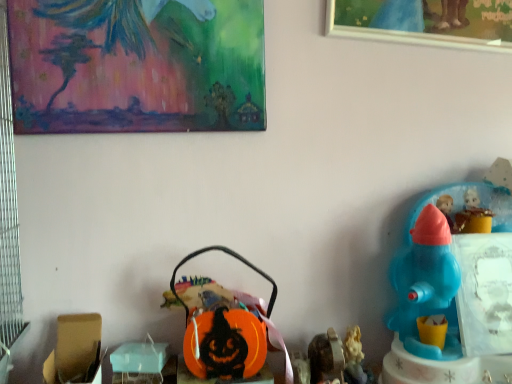
Image resolution: width=512 pixels, height=384 pixels. Describe the element at coordinates (354, 357) in the screenshot. I see `matte plastic figurine at lower right, the 2th toy from the right` at that location.

What do you see at coordinates (75, 350) in the screenshot? I see `matte cardboard box at lower left, the first toy positioned from the left` at bounding box center [75, 350].

This screenshot has width=512, height=384. Find the location of `wooden picture frame at upper right, the 1th picture frame viewed from the right`. wooden picture frame at upper right, the 1th picture frame viewed from the right is located at coordinates (425, 22).

Locate an element on the screen. metallic silver toy at lower center, marked as the third toy in a left-to-right arrangement is located at coordinates (326, 357).

Is matte plastic figurine at lower right, arranged as the fourth toy when viewed from the left, beside orange plastic basket at center, the 2th toy in the left-to-right sequence?

No, matte plastic figurine at lower right, arranged as the fourth toy when viewed from the left, is not in contact with orange plastic basket at center, the 2th toy in the left-to-right sequence.

Which object is further away from the camera, matte plastic figurine at lower right, the 2th toy from the right, or orange plastic basket at center, which appears as the 4th toy when viewed from the right?

matte plastic figurine at lower right, the 2th toy from the right, is more distant.

From a real-world perspective, who is located higher, matte plastic figurine at lower right, arranged as the fourth toy when viewed from the left, or orange plastic basket at center, which appears as the 4th toy when viewed from the right?

orange plastic basket at center, which appears as the 4th toy when viewed from the right, from a real-world perspective.

Would you say matte plastic figurine at lower right, the 2th toy from the right, is outside orange plastic basket at center, the 2th toy in the left-to-right sequence?

Yes.

Which of these two, matte plastic figurine at lower right, the 2th toy from the right, or painted canvas at upper left, the 2th picture frame positioned from the right, stands taller?

Standing taller between the two is painted canvas at upper left, the 2th picture frame positioned from the right.

Is painted canvas at upper left, the 2th picture frame positioned from the right, a part of matte plastic figurine at lower right, arranged as the fourth toy when viewed from the left?

No, painted canvas at upper left, the 2th picture frame positioned from the right, is not a part of matte plastic figurine at lower right, arranged as the fourth toy when viewed from the left.

Considering the sizes of matte plastic figurine at lower right, the 2th toy from the right, and painted canvas at upper left, the 2th picture frame positioned from the right, in the image, is matte plastic figurine at lower right, the 2th toy from the right, wider or thinner than painted canvas at upper left, the 2th picture frame positioned from the right,?

In the image, matte plastic figurine at lower right, the 2th toy from the right, appears to be wider than painted canvas at upper left, the 2th picture frame positioned from the right.

Between matte plastic figurine at lower right, the 2th toy from the right, and painted canvas at upper left, arranged as the first picture frame when viewed from the left, which one is positioned in front?

painted canvas at upper left, arranged as the first picture frame when viewed from the left.

Considering the sizes of objects painted canvas at upper left, the 2th picture frame positioned from the right, and orange plastic basket at center, which appears as the 4th toy when viewed from the right, in the image provided, who is thinner, painted canvas at upper left, the 2th picture frame positioned from the right, or orange plastic basket at center, which appears as the 4th toy when viewed from the right,?

painted canvas at upper left, the 2th picture frame positioned from the right.

Is painted canvas at upper left, the 2th picture frame positioned from the right, placed right next to orange plastic basket at center, which appears as the 4th toy when viewed from the right?

painted canvas at upper left, the 2th picture frame positioned from the right, and orange plastic basket at center, which appears as the 4th toy when viewed from the right, are clearly separated.

How much distance is there between painted canvas at upper left, the 2th picture frame positioned from the right, and orange plastic basket at center, which appears as the 4th toy when viewed from the right?

The distance of painted canvas at upper left, the 2th picture frame positioned from the right, from orange plastic basket at center, which appears as the 4th toy when viewed from the right, is 13.02 inches.

From the image's perspective, is painted canvas at upper left, the 2th picture frame positioned from the right, located above orange plastic basket at center, which appears as the 4th toy when viewed from the right?

Correct, painted canvas at upper left, the 2th picture frame positioned from the right, appears higher than orange plastic basket at center, which appears as the 4th toy when viewed from the right, in the image.

Is blue plastic toy at right, placed as the 1th toy when sorted from right to left, closer to the viewer compared to painted canvas at upper left, the 2th picture frame positioned from the right?

Yes, it is.

Is painted canvas at upper left, the 2th picture frame positioned from the right, surrounded by blue plastic toy at right, placed as the fifth toy when sorted from left to right?

No, painted canvas at upper left, the 2th picture frame positioned from the right, is not a part of blue plastic toy at right, placed as the fifth toy when sorted from left to right.

Is blue plastic toy at right, placed as the 1th toy when sorted from right to left, bigger or smaller than painted canvas at upper left, arranged as the first picture frame when viewed from the left?

Clearly, blue plastic toy at right, placed as the 1th toy when sorted from right to left, is larger in size than painted canvas at upper left, arranged as the first picture frame when viewed from the left.

From the picture: Which of these two, blue plastic toy at right, placed as the 1th toy when sorted from right to left, or painted canvas at upper left, arranged as the first picture frame when viewed from the left, stands taller?

Standing taller between the two is painted canvas at upper left, arranged as the first picture frame when viewed from the left.

Is metallic silver toy at lower center, the 3th toy from the right, inside blue plastic toy at right, placed as the fifth toy when sorted from left to right?

No, metallic silver toy at lower center, the 3th toy from the right, is located outside of blue plastic toy at right, placed as the fifth toy when sorted from left to right.

You are a GUI agent. You are given a task and a screenshot of the screen. Output one action in this format:
    pyautogui.click(x=<x>, y=<y>)
    Task: Click on the toy that is the 3rd one above the metallic silver toy at lower center, the 3th toy from the right (from a real-world perspective)
    
    Given the screenshot: What is the action you would take?
    pyautogui.click(x=453, y=293)

Is point (504, 298) closer to viewer compared to point (314, 378)?

No, it is behind (314, 378).

Does blue plastic toy at right, placed as the 1th toy when sorted from right to left, have a smaller size compared to metallic silver toy at lower center, the 3th toy from the right?

No.

Can you see blue plastic toy at right, placed as the 1th toy when sorted from right to left, touching orange plastic basket at center, which appears as the 4th toy when viewed from the right?

No.

Is blue plastic toy at right, placed as the fifth toy when sorted from left to right, completely or partially outside of orange plastic basket at center, which appears as the 4th toy when viewed from the right?

Absolutely, blue plastic toy at right, placed as the fifth toy when sorted from left to right, is external to orange plastic basket at center, which appears as the 4th toy when viewed from the right.

Locate an element on the screen. the 3rd toy behind the blue plastic toy at right, placed as the fifth toy when sorted from left to right is located at coordinates (229, 332).

Which object is positioned more to the left, orange plastic basket at center, the 2th toy in the left-to-right sequence, or matte plastic figurine at lower right, arranged as the fourth toy when viewed from the left?

orange plastic basket at center, the 2th toy in the left-to-right sequence.

Choose the correct answer: Is orange plastic basket at center, which appears as the 4th toy when viewed from the right, inside matte plastic figurine at lower right, arranged as the fourth toy when viewed from the left, or outside it?

orange plastic basket at center, which appears as the 4th toy when viewed from the right, exists outside the volume of matte plastic figurine at lower right, arranged as the fourth toy when viewed from the left.

Considering the sizes of objects orange plastic basket at center, the 2th toy in the left-to-right sequence, and matte plastic figurine at lower right, the 2th toy from the right, in the image provided, who is shorter, orange plastic basket at center, the 2th toy in the left-to-right sequence, or matte plastic figurine at lower right, the 2th toy from the right,?

Standing shorter between the two is matte plastic figurine at lower right, the 2th toy from the right.

From the picture: Between orange plastic basket at center, which appears as the 4th toy when viewed from the right, and matte plastic figurine at lower right, the 2th toy from the right, which one has larger width?

With larger width is orange plastic basket at center, which appears as the 4th toy when viewed from the right.

The width and height of the screenshot is (512, 384). What are the coordinates of `the 2nd toy to the left of the matte plastic figurine at lower right, the 2th toy from the right, starting your count from the anchor` in the screenshot? It's located at (229, 332).

The width and height of the screenshot is (512, 384). I want to click on picture frame that is the 1st one above the matte plastic figurine at lower right, the 2th toy from the right (from a real-world perspective), so click(137, 65).

Estimate the real-world distances between objects in this image. Which object is closer to painted canvas at upper left, the 2th picture frame positioned from the right, metallic silver toy at lower center, the 3th toy from the right, or orange plastic basket at center, which appears as the 4th toy when viewed from the right?

orange plastic basket at center, which appears as the 4th toy when viewed from the right, lies closer to painted canvas at upper left, the 2th picture frame positioned from the right, than the other object.

Which object lies nearer to the anchor point matte cardboard box at lower left, the first toy positioned from the left, blue plastic toy at right, placed as the fifth toy when sorted from left to right, or metallic silver toy at lower center, marked as the third toy in a left-to-right arrangement?

metallic silver toy at lower center, marked as the third toy in a left-to-right arrangement, is closer to matte cardboard box at lower left, the first toy positioned from the left.

From the image, which object appears to be nearer to matte cardboard box at lower left, which is counted as the fifth toy, starting from the right, matte plastic figurine at lower right, arranged as the fourth toy when viewed from the left, or orange plastic basket at center, the 2th toy in the left-to-right sequence?

orange plastic basket at center, the 2th toy in the left-to-right sequence, is closer to matte cardboard box at lower left, which is counted as the fifth toy, starting from the right.

Based on their spatial positions, is matte cardboard box at lower left, the first toy positioned from the left, or wooden picture frame at upper right, the 1th picture frame viewed from the right, further from metallic silver toy at lower center, marked as the third toy in a left-to-right arrangement?

Based on the image, wooden picture frame at upper right, the 1th picture frame viewed from the right, appears to be further to metallic silver toy at lower center, marked as the third toy in a left-to-right arrangement.

Based on their spatial positions, is matte plastic figurine at lower right, the 2th toy from the right, or blue plastic toy at right, placed as the 1th toy when sorted from right to left, further from wooden picture frame at upper right, the 1th picture frame viewed from the right?

matte plastic figurine at lower right, the 2th toy from the right, is positioned further to the anchor wooden picture frame at upper right, the 1th picture frame viewed from the right.

From the image, which object appears to be farther from painted canvas at upper left, arranged as the first picture frame when viewed from the left, wooden picture frame at upper right, which ranks as the second picture frame in left-to-right order, or orange plastic basket at center, which appears as the 4th toy when viewed from the right?

orange plastic basket at center, which appears as the 4th toy when viewed from the right, is further to painted canvas at upper left, arranged as the first picture frame when viewed from the left.

Based on their spatial positions, is matte cardboard box at lower left, which is counted as the fifth toy, starting from the right, or orange plastic basket at center, which appears as the 4th toy when viewed from the right, further from blue plastic toy at right, placed as the fifth toy when sorted from left to right?

matte cardboard box at lower left, which is counted as the fifth toy, starting from the right, is further to blue plastic toy at right, placed as the fifth toy when sorted from left to right.

Estimate the real-world distances between objects in this image. Which object is further from orange plastic basket at center, which appears as the 4th toy when viewed from the right, matte cardboard box at lower left, which is counted as the fifth toy, starting from the right, or matte plastic figurine at lower right, the 2th toy from the right?

Based on the image, matte cardboard box at lower left, which is counted as the fifth toy, starting from the right, appears to be further to orange plastic basket at center, which appears as the 4th toy when viewed from the right.

Identify the location of toy located between matte cardboard box at lower left, which is counted as the fifth toy, starting from the right, and metallic silver toy at lower center, the 3th toy from the right, in the left-right direction. (229, 332).

Image resolution: width=512 pixels, height=384 pixels. In order to click on toy situated between orange plastic basket at center, which appears as the 4th toy when viewed from the right, and matte plastic figurine at lower right, arranged as the fourth toy when viewed from the left, from left to right in this screenshot , I will do `click(326, 357)`.

At what (x,y) coordinates should I click in order to perform the action: click on picture frame between wooden picture frame at upper right, which ranks as the second picture frame in left-to-right order, and orange plastic basket at center, which appears as the 4th toy when viewed from the right, from top to bottom. Please return your answer as a coordinate pair (x, y). Looking at the image, I should click on (137, 65).

Find the location of `toy between wooden picture frame at upper right, which ranks as the second picture frame in left-to-right order, and orange plastic basket at center, which appears as the 4th toy when viewed from the right, from top to bottom`. toy between wooden picture frame at upper right, which ranks as the second picture frame in left-to-right order, and orange plastic basket at center, which appears as the 4th toy when viewed from the right, from top to bottom is located at coordinates (453, 293).